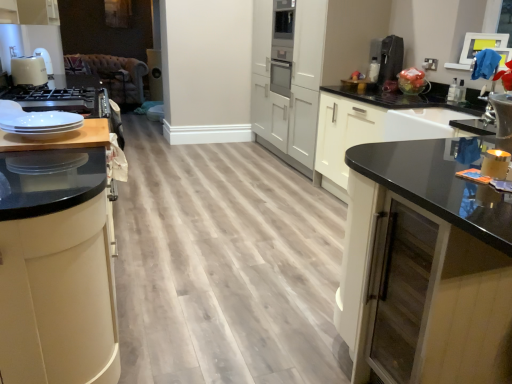
Question: Would you say satin black coffee machine at upper right is outside black glass cabinet at right, the second cabinetry when ordered from left to right?

Choices:
 (A) no
 (B) yes

Answer: (B)

Question: Is satin black coffee machine at upper right wider than black glass cabinet at right, placed as the first cabinetry when sorted from right to left?

Choices:
 (A) yes
 (B) no

Answer: (B)

Question: From the image's perspective, would you say satin black coffee machine at upper right is shown under black glass cabinet at right, the second cabinetry when ordered from left to right?

Choices:
 (A) no
 (B) yes

Answer: (A)

Question: Are satin black coffee machine at upper right and black glass cabinet at right, the second cabinetry when ordered from left to right, far apart?

Choices:
 (A) no
 (B) yes

Answer: (B)

Question: From a real-world perspective, is satin black coffee machine at upper right physically above black glass cabinet at right, the second cabinetry when ordered from left to right?

Choices:
 (A) no
 (B) yes

Answer: (B)

Question: Is the surface of satin black coffee machine at upper right in direct contact with black glass cabinet at right, placed as the first cabinetry when sorted from right to left?

Choices:
 (A) yes
 (B) no

Answer: (B)

Question: Is black glass cabinet at right, the second cabinetry when ordered from left to right, smaller than matte black cabinet at left, positioned as the 1th cabinetry in left-to-right order?

Choices:
 (A) no
 (B) yes

Answer: (A)

Question: From the image's perspective, is black glass cabinet at right, placed as the first cabinetry when sorted from right to left, located above matte black cabinet at left, positioned as the 1th cabinetry in left-to-right order?

Choices:
 (A) yes
 (B) no

Answer: (B)

Question: Is matte black cabinet at left, positioned as the 1th cabinetry in left-to-right order, located within black glass cabinet at right, placed as the first cabinetry when sorted from right to left?

Choices:
 (A) no
 (B) yes

Answer: (A)

Question: Can you confirm if black glass cabinet at right, the second cabinetry when ordered from left to right, is taller than matte black cabinet at left, which is the second cabinetry from right to left?

Choices:
 (A) no
 (B) yes

Answer: (A)

Question: Considering the relative sizes of black glass cabinet at right, placed as the first cabinetry when sorted from right to left, and matte black cabinet at left, which is the second cabinetry from right to left, in the image provided, is black glass cabinet at right, placed as the first cabinetry when sorted from right to left, wider than matte black cabinet at left, which is the second cabinetry from right to left,?

Choices:
 (A) no
 (B) yes

Answer: (B)

Question: Could you tell me if black glass cabinet at right, the second cabinetry when ordered from left to right, is facing matte black cabinet at left, positioned as the 1th cabinetry in left-to-right order?

Choices:
 (A) no
 (B) yes

Answer: (A)

Question: From the image's perspective, is matte black cabinet at left, which is the second cabinetry from right to left, on black glass cabinet at right, placed as the first cabinetry when sorted from right to left?

Choices:
 (A) yes
 (B) no

Answer: (A)